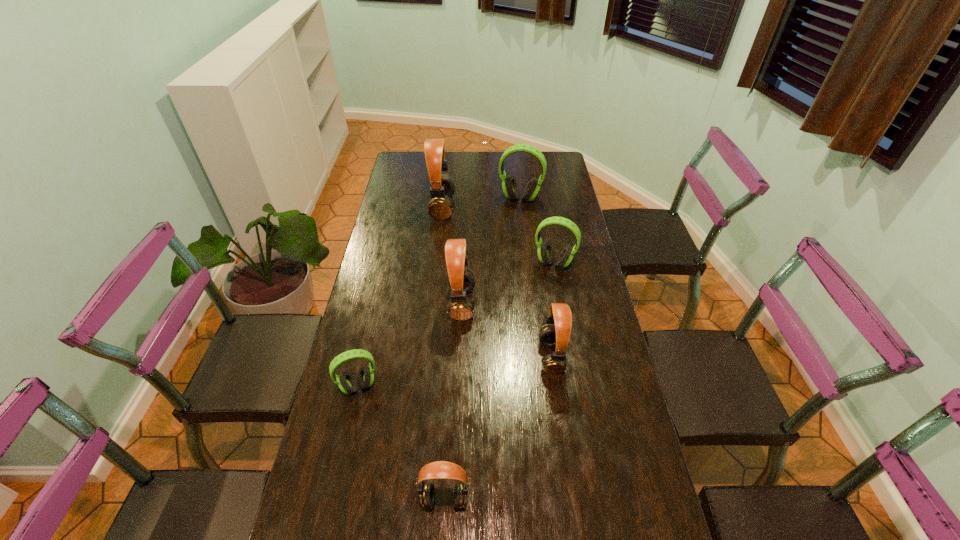
This screenshot has height=540, width=960. Find the location of `vacant region that satisfies the following two spatial constraints: 1. on the ear cups of the second nearest brown headset; 2. on the front side of the leftmost green headset`. vacant region that satisfies the following two spatial constraints: 1. on the ear cups of the second nearest brown headset; 2. on the front side of the leftmost green headset is located at coordinates (555, 386).